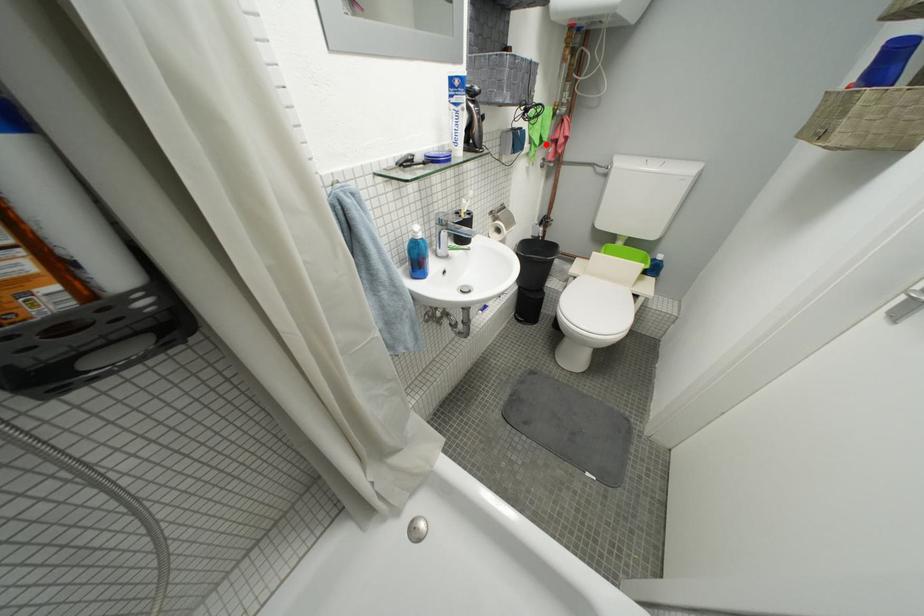
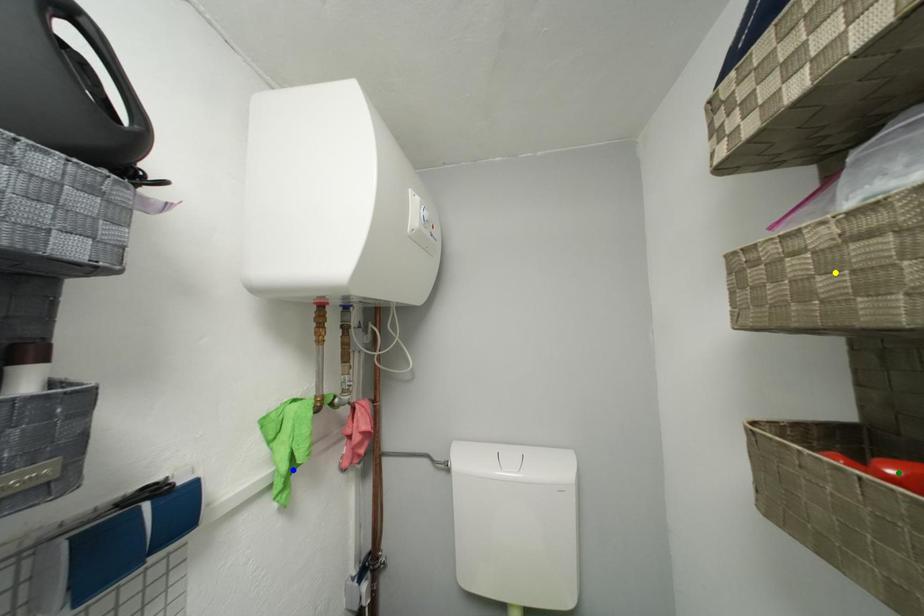
Question: I am providing you with two images of the same scene from different viewpoints. A red point is marked on the first image. You are given multiple points on the second image. In image 2, which mark is for the same physical point as the one in image 1?

Choices:
 (A) blue point
 (B) yellow point
 (C) green point

Answer: (A)